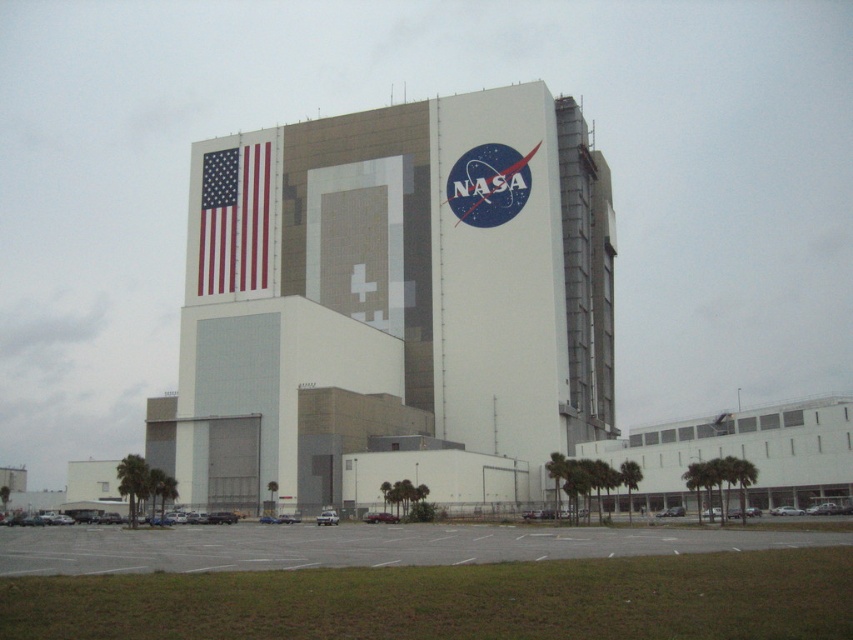
You are an architect reviewing a design blueprint of the white concrete building at center and the matte fabric flag at upper left. Which object occupies more space in the blueprint?

The white concrete building at center is larger in size than the matte fabric flag at upper left, so it occupies more space in the blueprint.

You are standing in front of the NASA building and notice two points marked on the facade. The first point is at coordinates point [503,90] and the second is at point [206,253]. Which point is closer to you?

Point [503,90] is in front of point [206,253], so it is closer to you.